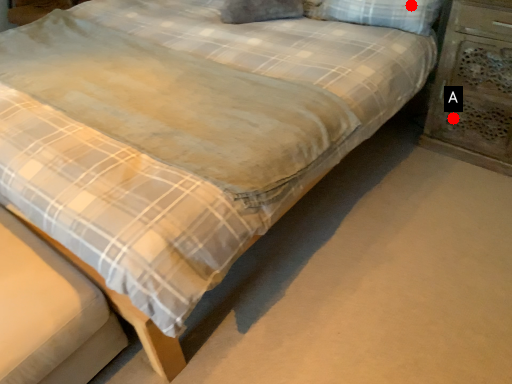
Question: Two points are circled on the image, labeled by A and B beside each circle. Which point is farther to the camera?

Choices:
 (A) A is further
 (B) B is further

Answer: (A)